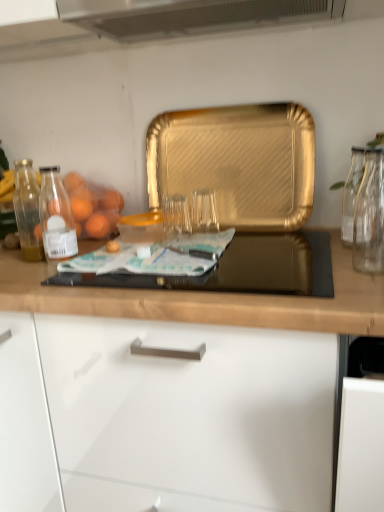
Question: Considering the relative positions of black glass gas stove at center and clear glass vase at right, the second glass jar viewed from the left, in the image provided, is black glass gas stove at center behind clear glass vase at right, the second glass jar viewed from the left,?

Choices:
 (A) no
 (B) yes

Answer: (A)

Question: Considering the relative positions of black glass gas stove at center and clear glass vase at right, the second glass jar viewed from the left, in the image provided, is black glass gas stove at center to the left of clear glass vase at right, the second glass jar viewed from the left, from the viewer's perspective?

Choices:
 (A) no
 (B) yes

Answer: (B)

Question: From the image's perspective, would you say black glass gas stove at center is shown under clear glass vase at right, the second glass jar viewed from the left?

Choices:
 (A) yes
 (B) no

Answer: (A)

Question: Is black glass gas stove at center next to clear glass vase at right, marked as the 1th glass jar in a right-to-left arrangement, and touching it?

Choices:
 (A) no
 (B) yes

Answer: (A)

Question: Is black glass gas stove at center positioned beyond the bounds of clear glass vase at right, the second glass jar viewed from the left?

Choices:
 (A) no
 (B) yes

Answer: (B)

Question: Does black glass gas stove at center turn towards clear glass vase at right, marked as the 1th glass jar in a right-to-left arrangement?

Choices:
 (A) yes
 (B) no

Answer: (B)

Question: From a real-world perspective, is black glass gas stove at center on top of transparent glass at center, the 1th glass jar from the left?

Choices:
 (A) yes
 (B) no

Answer: (B)

Question: Is the depth of black glass gas stove at center greater than that of transparent glass at center, which appears as the 2th glass jar when viewed from the right?

Choices:
 (A) yes
 (B) no

Answer: (B)

Question: Are black glass gas stove at center and transparent glass at center, the 1th glass jar from the left, located far from each other?

Choices:
 (A) no
 (B) yes

Answer: (A)

Question: Can you confirm if black glass gas stove at center is positioned to the left of transparent glass at center, the 1th glass jar from the left?

Choices:
 (A) no
 (B) yes

Answer: (A)

Question: Considering the relative sizes of black glass gas stove at center and transparent glass at center, the 1th glass jar from the left, in the image provided, is black glass gas stove at center smaller than transparent glass at center, the 1th glass jar from the left,?

Choices:
 (A) yes
 (B) no

Answer: (B)

Question: Does black glass gas stove at center have a lesser height compared to transparent glass at center, which appears as the 2th glass jar when viewed from the right?

Choices:
 (A) no
 (B) yes

Answer: (B)

Question: Is clear glass vase at right, marked as the 1th glass jar in a right-to-left arrangement, to the right of gold textured tray at center from the viewer's perspective?

Choices:
 (A) yes
 (B) no

Answer: (A)